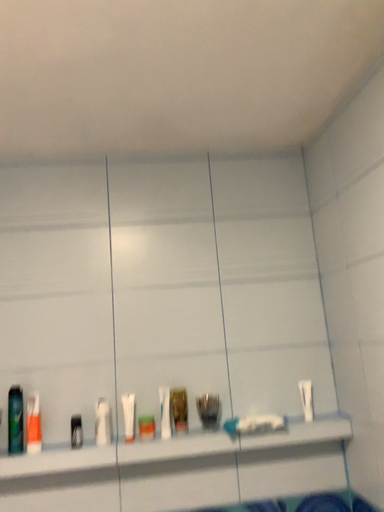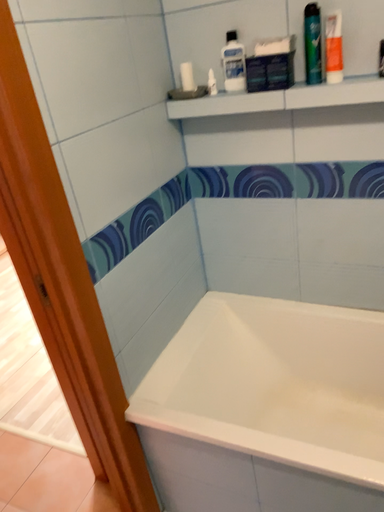
Question: Which way did the camera rotate in the video?

Choices:
 (A) rotated upward
 (B) rotated downward

Answer: (B)